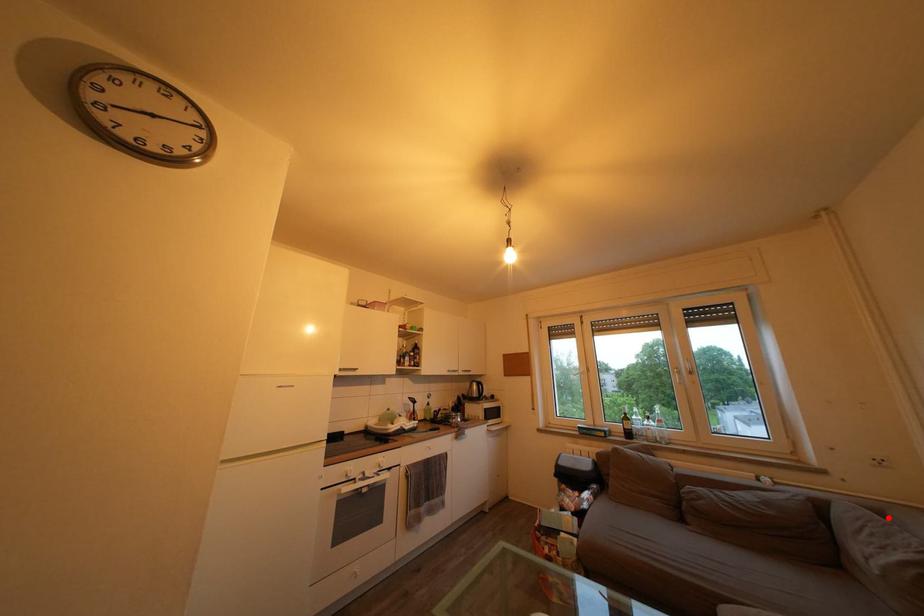
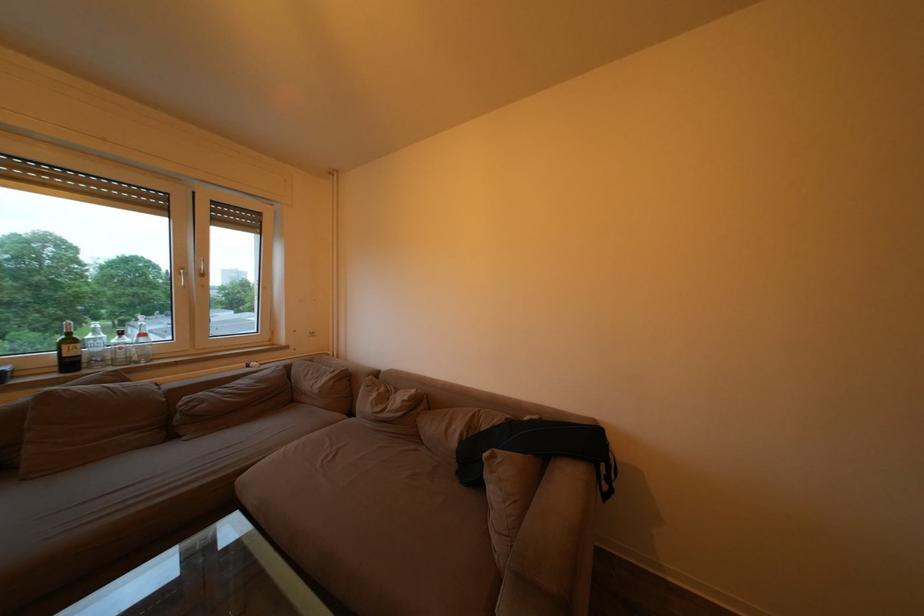
Question: I am providing you with two images of the same scene from different viewpoints. Given a red point in image1, look at the same physical point in image2. Is it:

Choices:
 (A) Closer to the viewpoint
 (B) Farther from the viewpoint

Answer: (B)